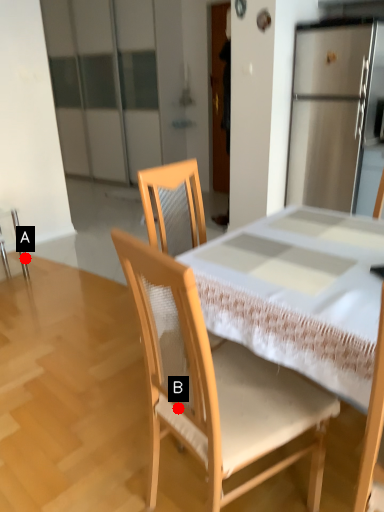
Question: Two points are circled on the image, labeled by A and B beside each circle. Which point is farther from the camera taking this photo?

Choices:
 (A) A is further
 (B) B is further

Answer: (A)